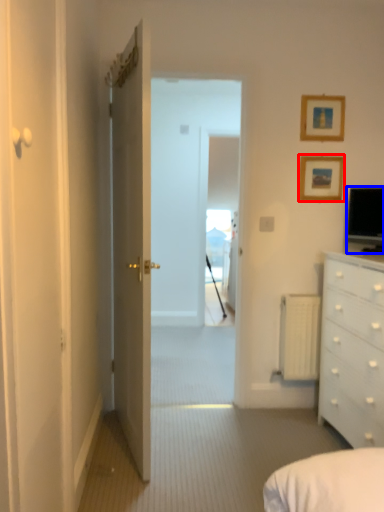
Question: Which point is closer to the camera, picture frame (highlighted by a red box) or television (highlighted by a blue box)?

Choices:
 (A) picture frame
 (B) television

Answer: (B)